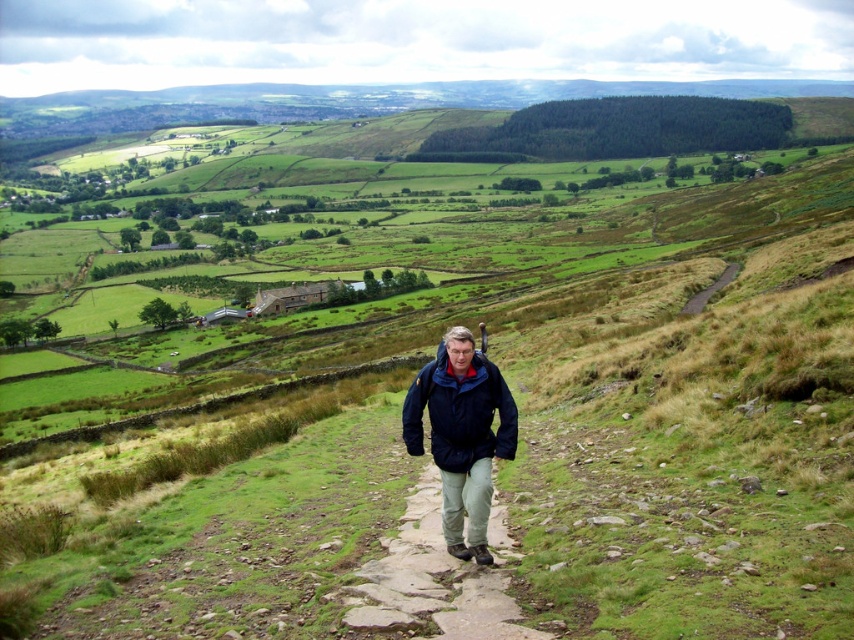
Is stone paved path at center positioned behind navy blue jacket at center?

No.

Can you confirm if stone paved path at center is smaller than navy blue jacket at center?

Yes, stone paved path at center is smaller than navy blue jacket at center.

Which is in front, point (420, 604) or point (468, 440)?

Point (420, 604)

At what (x,y) coordinates should I click in order to perform the action: click on stone paved path at center. Please return your answer as a coordinate pair (x, y). The image size is (854, 640). Looking at the image, I should click on (431, 580).